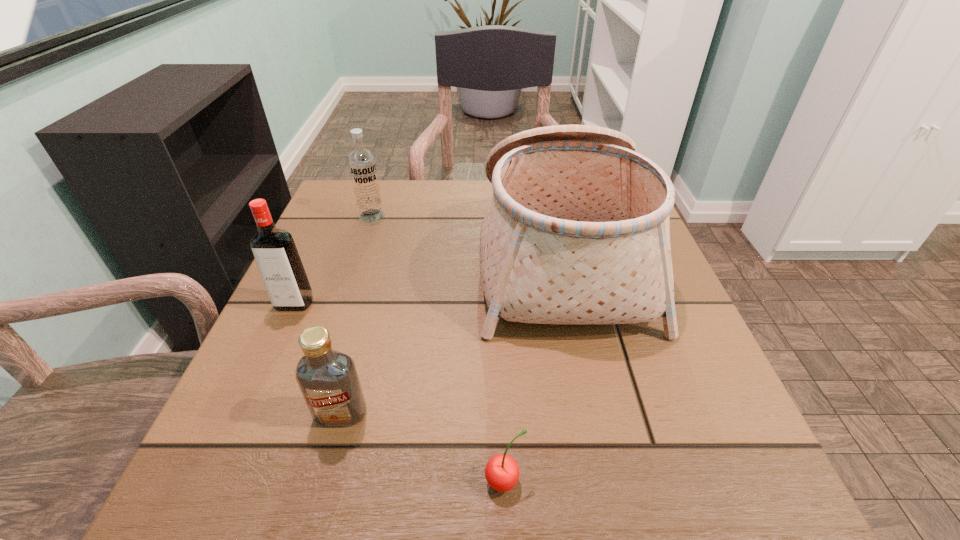
Identify the location of blank region between the leftmost object and the farthest vodka. The image size is (960, 540). (333, 260).

The width and height of the screenshot is (960, 540). I want to click on free spot between the shortest object and the leftmost object, so click(x=399, y=393).

Image resolution: width=960 pixels, height=540 pixels. I want to click on vacant point located between the leftmost object and the shortest object, so click(399, 393).

Identify the location of vacant area between the shortest object and the farthest vodka. (438, 348).

Find the location of a particular element. The width and height of the screenshot is (960, 540). free spot between the basket and the cherry is located at coordinates (533, 369).

The width and height of the screenshot is (960, 540). Find the location of `free area in between the leftmost vodka and the farthest vodka`. free area in between the leftmost vodka and the farthest vodka is located at coordinates (333, 260).

The width and height of the screenshot is (960, 540). Find the location of `vacant area between the farthest vodka and the basket`. vacant area between the farthest vodka and the basket is located at coordinates (467, 235).

Locate an element on the screen. the closest object to the shortest vodka is located at coordinates (502, 473).

Locate which object is the third closest to the cherry. Please provide its 2D coordinates. Your answer should be formatted as a tuple, i.e. [(x, y)], where the tuple contains the x and y coordinates of a point satisfying the conditions above.

[(280, 266)]

Point out which vodka is positioned as the second nearest to the farthest vodka. Please provide its 2D coordinates. Your answer should be formatted as a tuple, i.e. [(x, y)], where the tuple contains the x and y coordinates of a point satisfying the conditions above.

[(328, 379)]